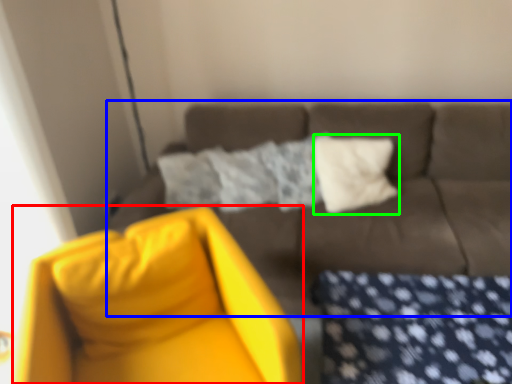
Question: Based on their relative distances, which object is farther from swivel chair (highlighted by a red box)? Choose from studio couch (highlighted by a blue box) and pillow (highlighted by a green box).

Choices:
 (A) studio couch
 (B) pillow

Answer: (B)